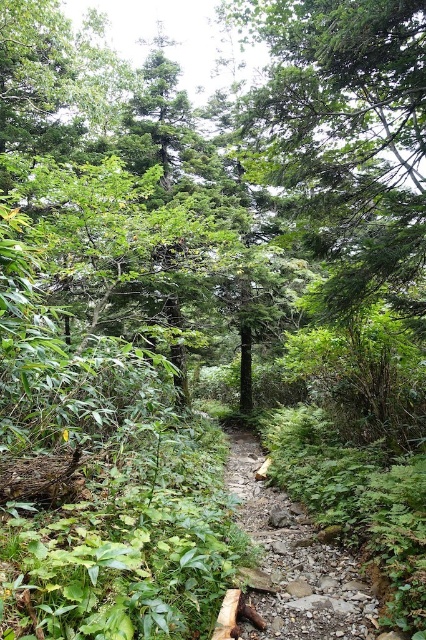
Question: Which point is farther to the camera?

Choices:
 (A) rough stone path at center
 (B) green leafy tree at center

Answer: (B)

Question: Among these points, which one is farthest from the camera?

Choices:
 (A) (376, 163)
 (B) (350, 627)

Answer: (A)

Question: Can you confirm if green leafy tree at center is positioned to the left of rough stone path at center?

Choices:
 (A) no
 (B) yes

Answer: (A)

Question: Is green leafy tree at center wider than rough stone path at center?

Choices:
 (A) no
 (B) yes

Answer: (B)

Question: Is green leafy tree at center behind rough stone path at center?

Choices:
 (A) no
 (B) yes

Answer: (B)

Question: Which point appears closest to the camera in this image?

Choices:
 (A) (265, 579)
 (B) (389, 26)

Answer: (A)